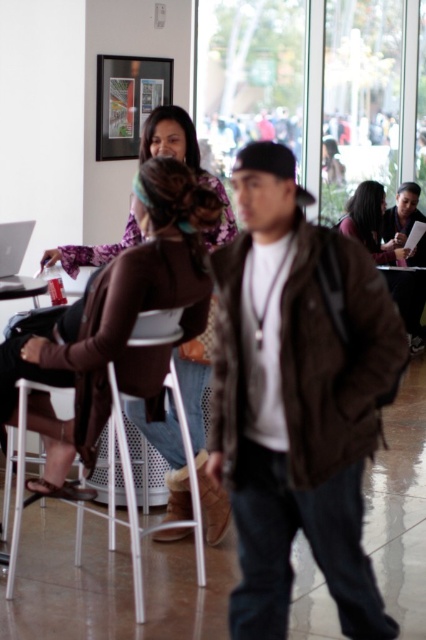
Question: Which object is the farthest from the matte white laptop at left?

Choices:
 (A) matte brown jacket at center
 (B) matte purple blouse at upper left
 (C) matte black laptop at upper center

Answer: (C)

Question: Does matte black laptop at upper center appear under matte white laptop at left?

Choices:
 (A) yes
 (B) no

Answer: (B)

Question: Is matte brown jacket at center below matte black laptop at upper center?

Choices:
 (A) no
 (B) yes

Answer: (B)

Question: Estimate the real-world distances between objects in this image. Which object is farther from the matte black laptop at upper center?

Choices:
 (A) brown leather jacket at center
 (B) matte purple blouse at upper left
 (C) white plastic chair at lower center
 (D) matte white laptop at left

Answer: (A)

Question: Considering the relative positions of white plastic chair at lower center and matte brown jacket at center in the image provided, where is white plastic chair at lower center located with respect to matte brown jacket at center?

Choices:
 (A) left
 (B) right

Answer: (A)

Question: Which object is the closest to the matte purple blouse at upper left?

Choices:
 (A) matte black laptop at upper center
 (B) brown leather jacket at center
 (C) matte white laptop at left

Answer: (B)